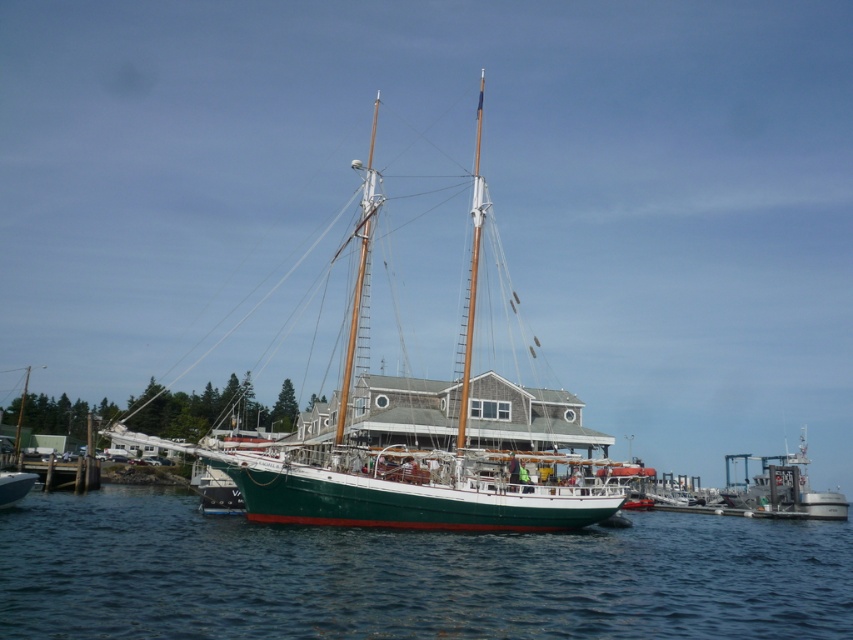
Question: Which object appears farthest from the camera in this image?

Choices:
 (A) green matte water at center
 (B) green matte sailboat at center
 (C) metallic gray boat at right

Answer: (C)

Question: Does green matte sailboat at center appear on the right side of metallic gray boat at right?

Choices:
 (A) no
 (B) yes

Answer: (A)

Question: Which of the following is the closest to the observer?

Choices:
 (A) (834, 499)
 (B) (262, 496)
 (C) (328, 577)

Answer: (C)

Question: Does green matte water at center appear on the left side of metallic gray boat at right?

Choices:
 (A) yes
 (B) no

Answer: (A)

Question: Which object appears farthest from the camera in this image?

Choices:
 (A) green matte sailboat at center
 (B) metallic gray boat at right

Answer: (B)

Question: Does green matte water at center have a lesser width compared to metallic gray boat at right?

Choices:
 (A) no
 (B) yes

Answer: (B)